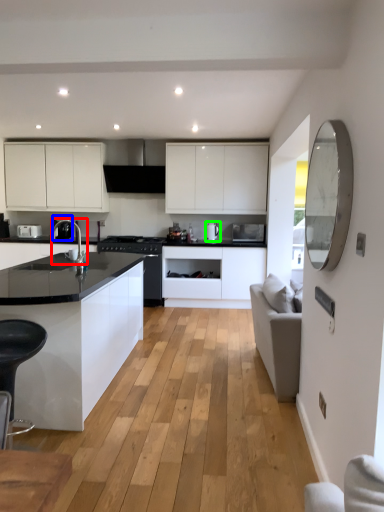
Question: Estimate the real-world distances between objects in this image. Which object is farther from sink (highlighted by a red box), coffee machine (highlighted by a blue box) or kitchen appliance (highlighted by a green box)?

Choices:
 (A) coffee machine
 (B) kitchen appliance

Answer: (B)